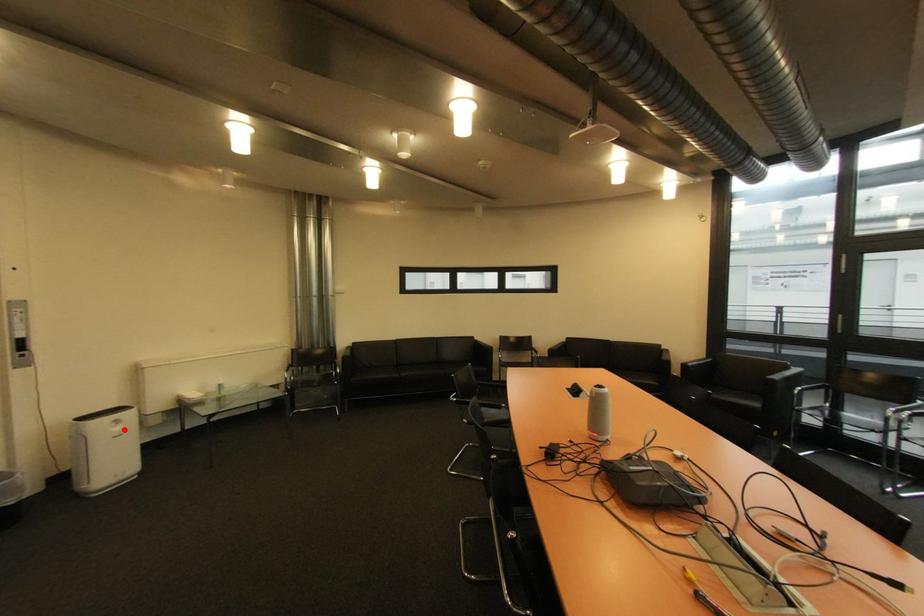
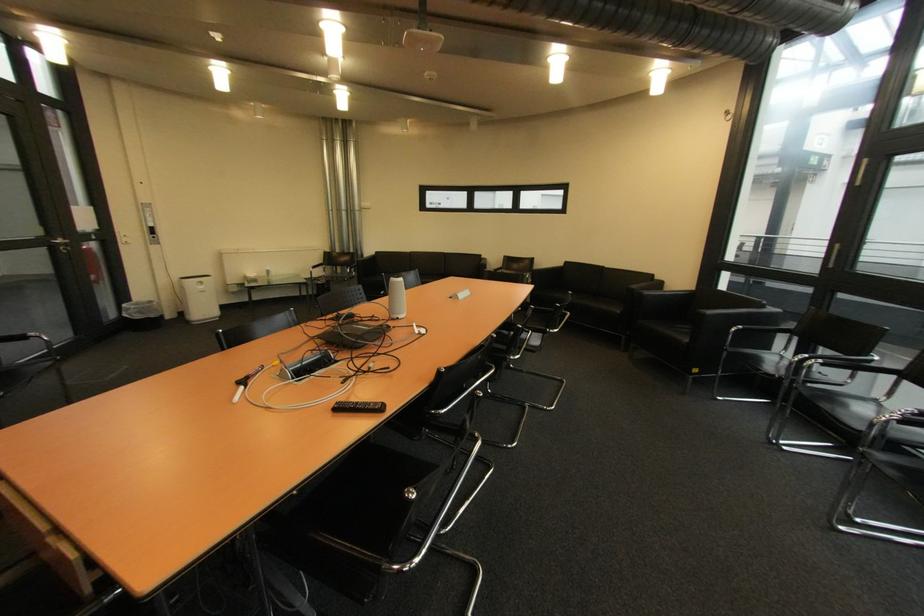
In the second image, find the point that corresponds to the highlighted location in the first image.

(209, 288)